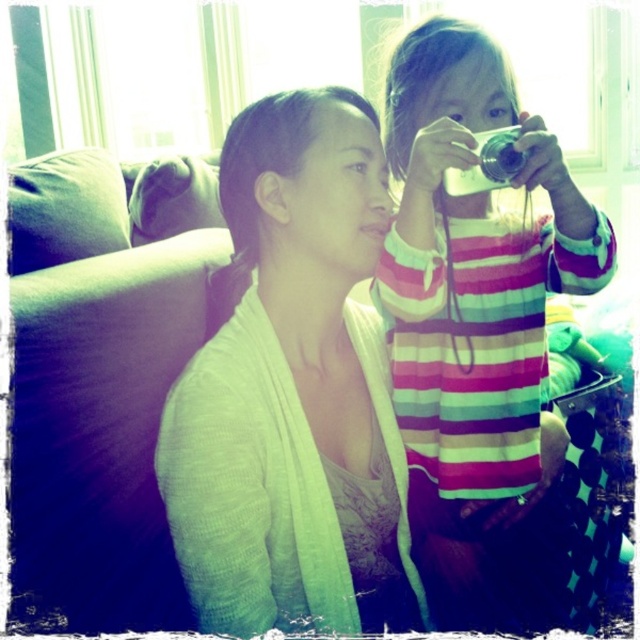
Between green textured sweater at center and striped fabric shirt at upper right, which one is positioned higher?

Positioned higher is striped fabric shirt at upper right.

Where is `green textured sweater at center`? green textured sweater at center is located at coordinates (292, 390).